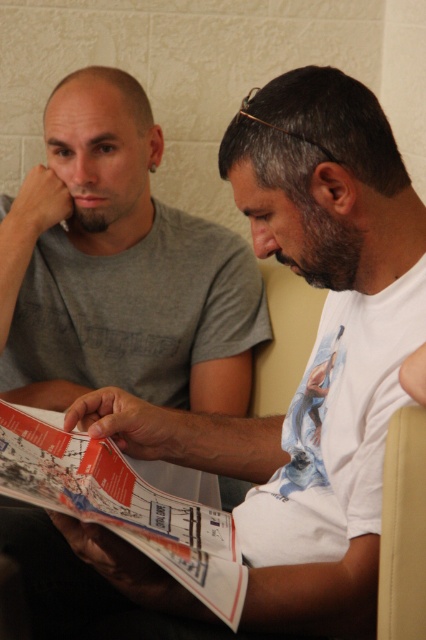
Does printed paper magazine at center appear on the right side of beige fabric armchair at right?

No, printed paper magazine at center is not to the right of beige fabric armchair at right.

Is printed paper magazine at center positioned in front of beige fabric armchair at right?

That is False.

Between point (60, 467) and point (394, 516), which one is positioned behind?

The point (60, 467) is more distant.

Where is `printed paper magazine at center`? The width and height of the screenshot is (426, 640). printed paper magazine at center is located at coordinates (121, 504).